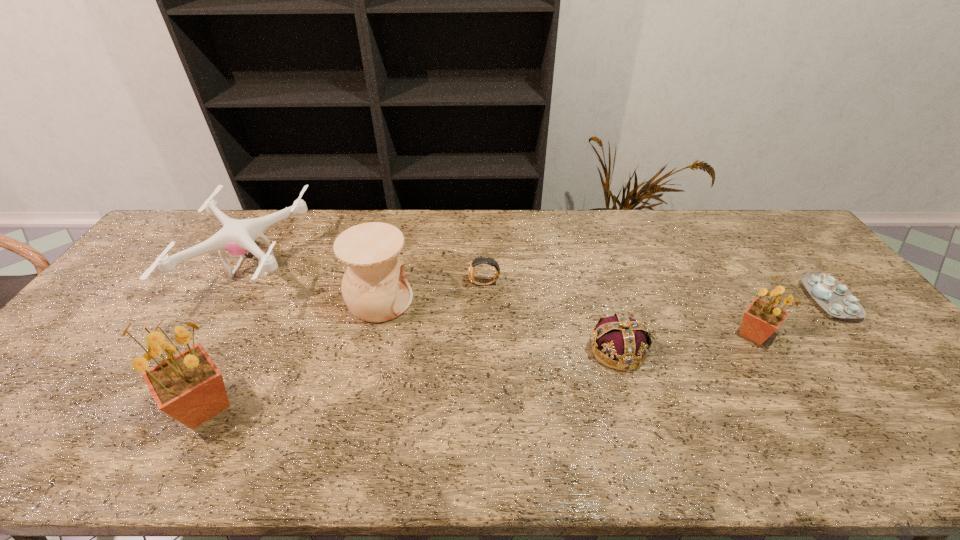
Find the location of `vacant space that's between the fourth tallest object and the third shortest object`. vacant space that's between the fourth tallest object and the third shortest object is located at coordinates (436, 309).

Identify the location of vacant space that is in between the drone and the crown. This screenshot has width=960, height=540. (436, 309).

Find the location of `vacant point located between the left sunflower and the third object from left to right`. vacant point located between the left sunflower and the third object from left to right is located at coordinates (292, 353).

Locate an element on the screen. The image size is (960, 540). vacant space in between the pottery and the watch is located at coordinates (432, 292).

Identify the location of vacant space in between the drone and the right sunflower. The width and height of the screenshot is (960, 540). (504, 301).

I want to click on vacant space that is in between the watch and the farther sunflower, so click(x=619, y=309).

The width and height of the screenshot is (960, 540). In order to click on free space between the rightmost object and the farther sunflower in this screenshot , I will do [791, 317].

The width and height of the screenshot is (960, 540). I want to click on vacant point located between the third object from right to left and the fifth object from right to left, so click(498, 325).

Find the location of a particular element. The height and width of the screenshot is (540, 960). the fourth closest object to the rightmost object is located at coordinates (374, 287).

Identify the location of object identified as the sixth closest to the third object from left to right. The image size is (960, 540). (834, 297).